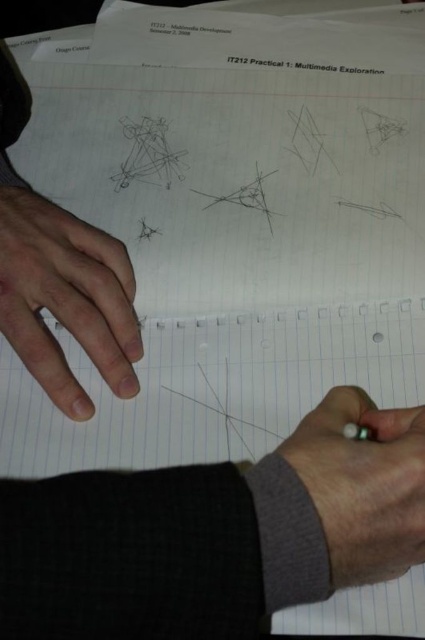
Question: Does dry skin at left appear over gray woolen sweater at lower right?

Choices:
 (A) no
 (B) yes

Answer: (B)

Question: Which point is farther from the camera taking this photo?

Choices:
 (A) (388, 525)
 (B) (36, 216)

Answer: (B)

Question: Is dry skin at left positioned in front of gray woolen sweater at lower right?

Choices:
 (A) no
 (B) yes

Answer: (A)

Question: Is dry skin at left smaller than gray woolen sweater at lower right?

Choices:
 (A) yes
 (B) no

Answer: (A)